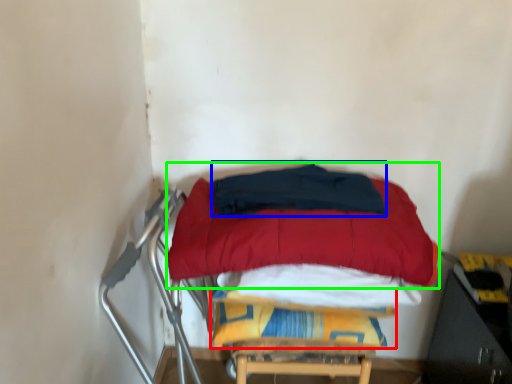
Question: Which object is the closest to the blanket (highlighted by a red box)? Choose among these: blanket (highlighted by a blue box) or mattress (highlighted by a green box).

Choices:
 (A) blanket
 (B) mattress

Answer: (B)